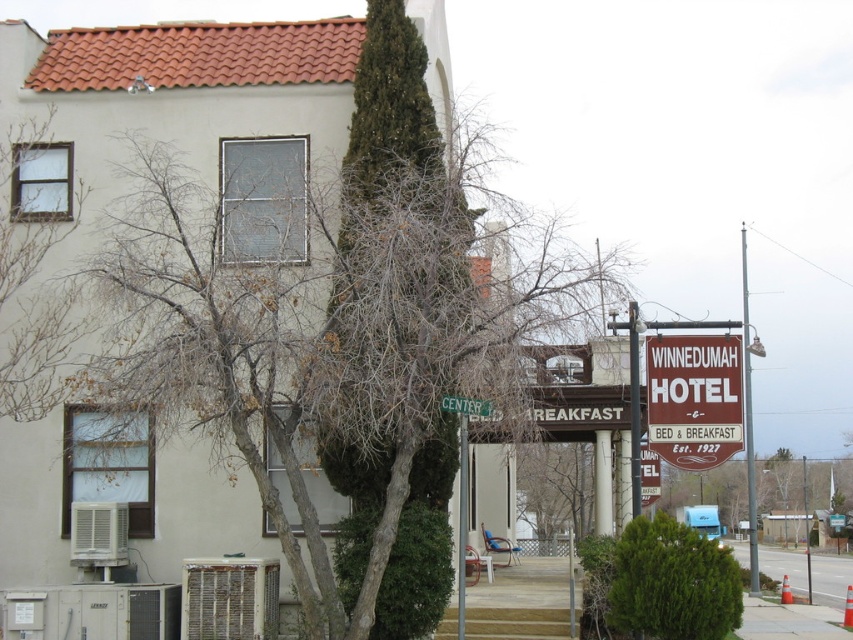
Question: Which of these objects is positioned closest to the brown wooden sign at center right?

Choices:
 (A) green leafy tree at center
 (B) white plastic street sign at center
 (C) green textured bush at center

Answer: (C)

Question: Can you confirm if bare branches at left is positioned below brown leafless branches at upper left?

Choices:
 (A) yes
 (B) no

Answer: (A)

Question: Based on their relative distances, which object is nearer to the brown leafless branches at upper left?

Choices:
 (A) green textured bush at center
 (B) green leafy tree at center
 (C) brown wooden sign at center right

Answer: (C)

Question: Which of the following is the closest to the observer?

Choices:
 (A) green textured bush at center
 (B) brown wooden sign at center right
 (C) white plastic street sign at center
 (D) brown leafless branches at upper left

Answer: (C)

Question: Does bare branches at left have a lesser width compared to white plastic street sign at center?

Choices:
 (A) yes
 (B) no

Answer: (B)

Question: Where is green textured bush at center located in relation to green leafy tree at center in the image?

Choices:
 (A) above
 (B) below

Answer: (A)